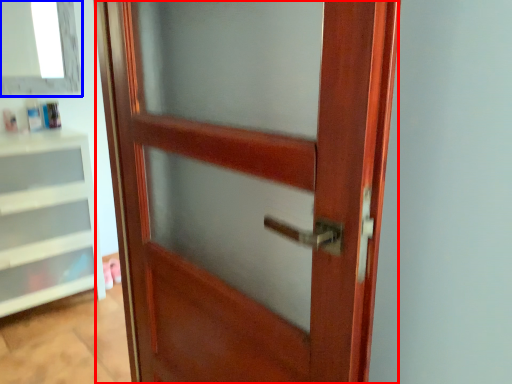
Question: Which of the following is the closest to the observer, door (highlighted by a red box) or window (highlighted by a blue box)?

Choices:
 (A) door
 (B) window

Answer: (A)